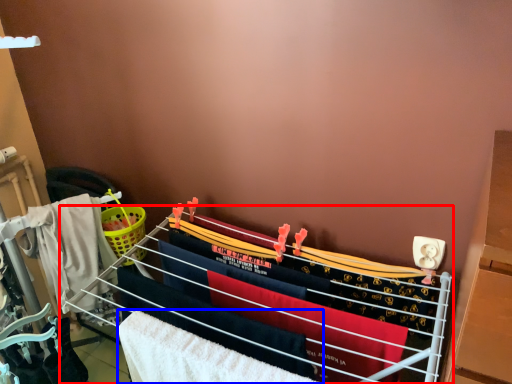
Question: Which point is closer to the camera, furniture (highlighted by a red box) or beach towel (highlighted by a blue box)?

Choices:
 (A) furniture
 (B) beach towel

Answer: (A)